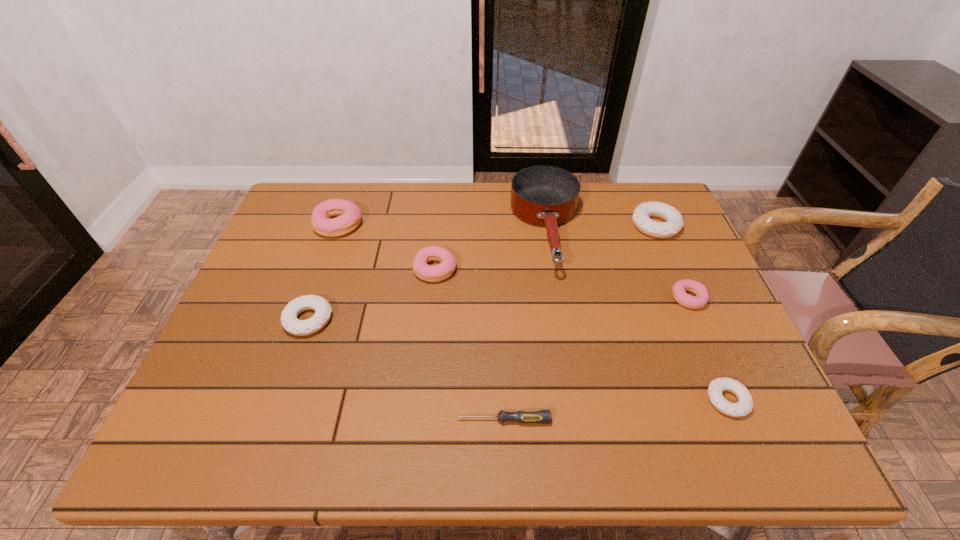
Identify the location of vacant space at the far edge of the desktop. (459, 225).

Locate an element on the screen. free location at the near edge is located at coordinates (361, 427).

This screenshot has height=540, width=960. In order to click on blank area at the left edge in this screenshot , I will do `click(210, 373)`.

Where is `vacant space at the right edge of the desktop`? The image size is (960, 540). vacant space at the right edge of the desktop is located at coordinates (705, 279).

In the image, there is a desktop. Where is `vacant space at the far left corner`? vacant space at the far left corner is located at coordinates (290, 205).

At what (x,y) coordinates should I click in order to perform the action: click on vacant space at the near left corner. Please return your answer as a coordinate pair (x, y). The image size is (960, 540). Looking at the image, I should click on (203, 419).

This screenshot has height=540, width=960. In the image, there is a desktop. What are the coordinates of `vacant space at the far right corner` in the screenshot? It's located at (652, 198).

I want to click on blank space at the near right corner of the desktop, so click(752, 438).

Locate an element on the screen. Image resolution: width=960 pixels, height=540 pixels. free space between the rightmost pink doughnut and the shortest doughnut is located at coordinates (708, 349).

You are a GUI agent. You are given a task and a screenshot of the screen. Output one action in this format:
    pyautogui.click(x=<x>, y=<y>)
    Task: Click on the free space between the biggest white doughnut and the rightmost pink doughnut
    The height and width of the screenshot is (540, 960).
    Given the screenshot: What is the action you would take?
    pyautogui.click(x=672, y=262)